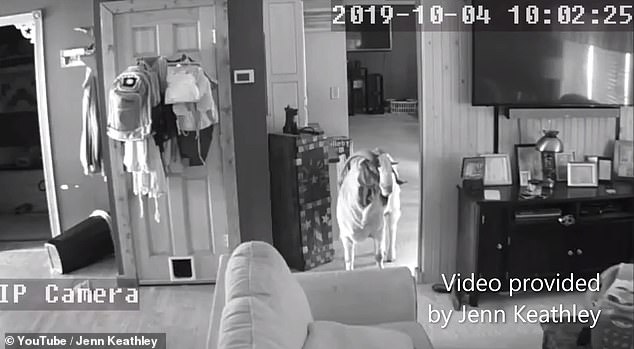
Locate an element on the screen. The image size is (634, 349). cushion is located at coordinates 352,333, 285,326.